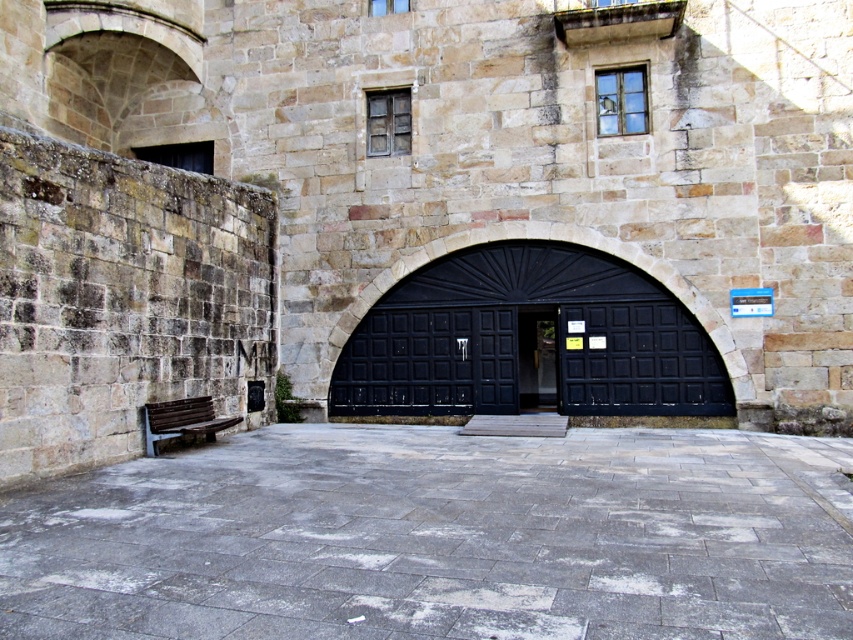
Question: Among these points, which one is farthest from the camera?

Choices:
 (A) (502, 372)
 (B) (532, 371)
 (C) (668, 385)
 (D) (509, 346)

Answer: (B)

Question: Is black wooden gate at center further to the viewer compared to brown wooden bench at lower left?

Choices:
 (A) no
 (B) yes

Answer: (B)

Question: Which point is closer to the camera taking this photo?

Choices:
 (A) (672, 332)
 (B) (532, 380)
 (C) (502, 342)
 (D) (569, 284)

Answer: (A)

Question: Does dark wood door at center have a smaller size compared to brown wooden bench at lower left?

Choices:
 (A) yes
 (B) no

Answer: (A)

Question: From the image, what is the correct spatial relationship of dark wood door at center in relation to brown wooden bench at lower left?

Choices:
 (A) below
 (B) above

Answer: (B)

Question: Considering the real-world distances, which object is closest to the dark wood door at center?

Choices:
 (A) black matte door at center
 (B) brown wooden bench at lower left

Answer: (A)